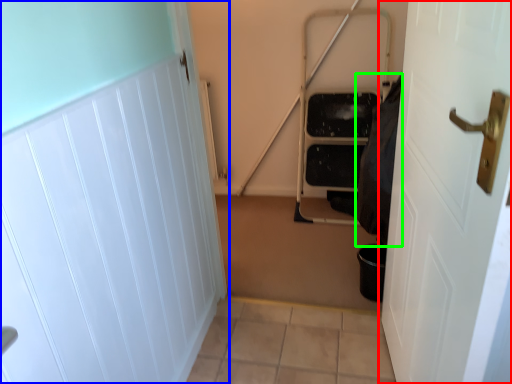
Question: Which object is positioned farthest from door (highlighted by a red box)? Select from door (highlighted by a blue box) and material (highlighted by a green box).

Choices:
 (A) door
 (B) material

Answer: (A)